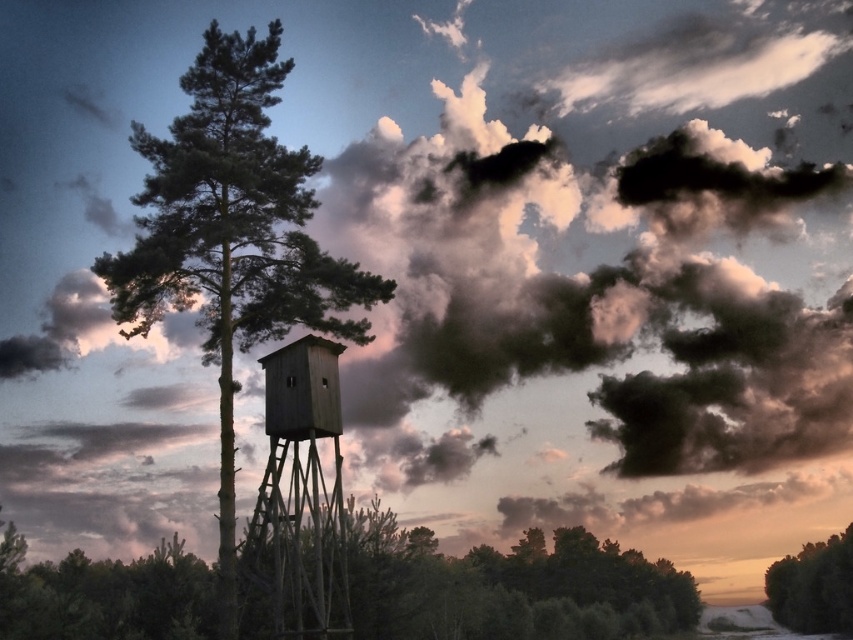
How far apart are green matte tree at center and wooden tower at center?

green matte tree at center and wooden tower at center are 3.66 meters apart.

Between green matte tree at center and wooden tower at center, which one appears on the right side from the viewer's perspective?

wooden tower at center

Which is behind, point (251, 292) or point (293, 589)?

The point (251, 292) is more distant.

Find the location of a particular element. green matte tree at center is located at coordinates (231, 240).

Which is more to the left, smooth bark tree at center or wooden tower at center?

Positioned to the left is wooden tower at center.

Is point (554, 609) farther from camera compared to point (283, 401)?

Yes, point (554, 609) is behind point (283, 401).

You are a GUI agent. You are given a task and a screenshot of the screen. Output one action in this format:
    pyautogui.click(x=<x>, y=<y>)
    Task: Click on the smooth bark tree at center
    The height and width of the screenshot is (640, 853).
    Given the screenshot: What is the action you would take?
    pyautogui.click(x=509, y=586)

Is green matte tree at center closer to camera compared to green matte tree at lower right?

That is True.

Who is shorter, green matte tree at center or green matte tree at lower right?

green matte tree at lower right is shorter.

Which is behind, point (277, 35) or point (830, 580)?

Positioned behind is point (830, 580).

Identify the location of green matte tree at center. Image resolution: width=853 pixels, height=640 pixels. (231, 240).